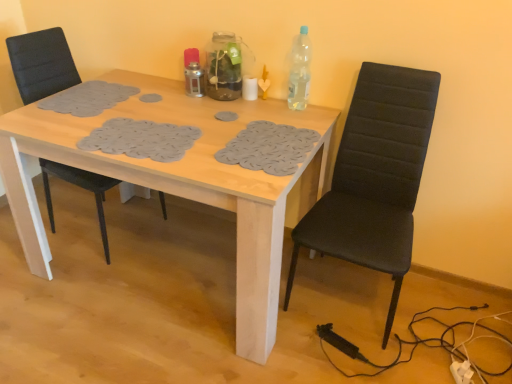
Question: From the image's perspective, relative to black fabric chair at left, the 1th chair positioned from the left, is clear plastic bottle at upper right above or below?

Choices:
 (A) above
 (B) below

Answer: (A)

Question: Looking at their shapes, would you say clear plastic bottle at upper right is wider or thinner than black fabric chair at left, the 1th chair positioned from the left?

Choices:
 (A) wide
 (B) thin

Answer: (B)

Question: Estimate the real-world distances between objects in this image. Which object is closer to the black fabric chair at left, placed as the 2th chair when sorted from right to left?

Choices:
 (A) clear plastic bottle at upper right
 (B) light wood table at center
 (C) black fabric chair at right, the first chair from the right

Answer: (B)

Question: Estimate the real-world distances between objects in this image. Which object is farther from the black fabric chair at right, the 2th chair viewed from the left?

Choices:
 (A) black fabric chair at left, placed as the 2th chair when sorted from right to left
 (B) light wood table at center
 (C) clear plastic bottle at upper right

Answer: (A)